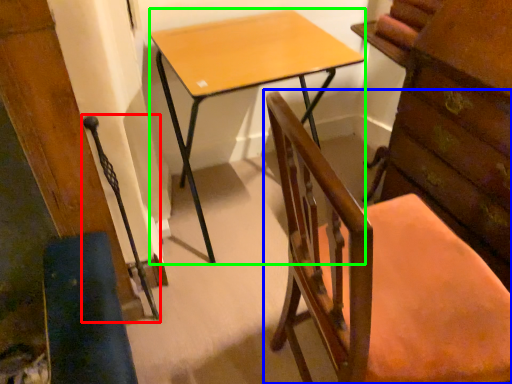
Question: Estimate the real-world distances between objects in this image. Which object is farther from swivel chair (highlighted by a red box), chair (highlighted by a blue box) or desk (highlighted by a green box)?

Choices:
 (A) chair
 (B) desk

Answer: (A)